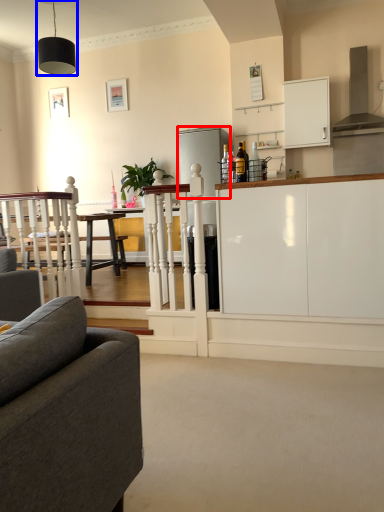
Question: Which of the following is the closest to the observer, appliance (highlighted by a red box) or light fixture (highlighted by a blue box)?

Choices:
 (A) appliance
 (B) light fixture

Answer: (B)